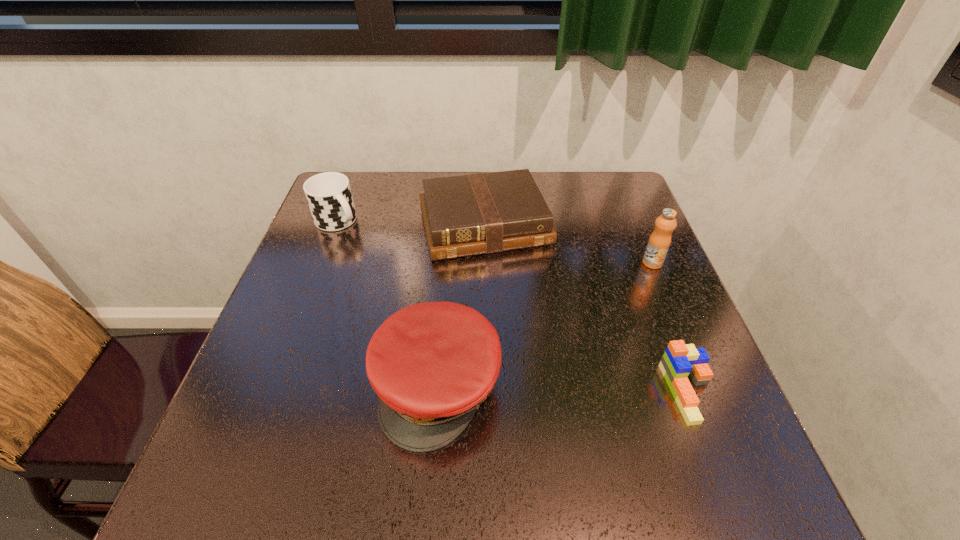
Where is `cap`? cap is located at coordinates (431, 364).

Locate an element on the screen. This screenshot has height=540, width=960. Lego is located at coordinates (679, 360).

Locate an element on the screen. This screenshot has width=960, height=540. the tallest object is located at coordinates [659, 242].

Identify the location of Bible. This screenshot has height=540, width=960. (472, 214).

The height and width of the screenshot is (540, 960). Find the location of `the leftmost object`. the leftmost object is located at coordinates (329, 196).

In order to click on vacant region located on the back of the Lego in this screenshot , I will do `click(642, 268)`.

I want to click on free location located on the front label of the orange juice, so click(605, 369).

Where is `vacant space situated on the front label of the orange juice`? The image size is (960, 540). vacant space situated on the front label of the orange juice is located at coordinates (622, 330).

In order to click on blank space located 0.150m on the front label of the orange juice in this screenshot , I will do `click(632, 309)`.

Locate an element on the screen. This screenshot has height=540, width=960. vacant area situated on the spine side of the Bible is located at coordinates (512, 294).